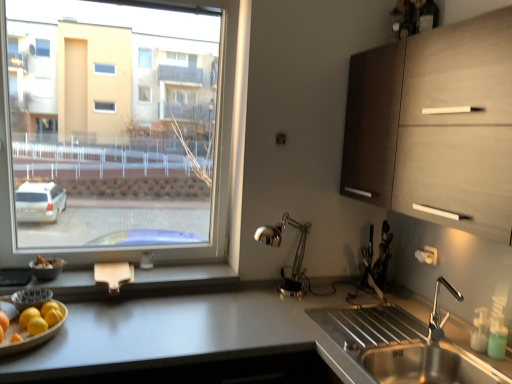
Question: Would you consider white glossy countertop at lower left to be distant from polished metal desk lamp at center?

Choices:
 (A) yes
 (B) no

Answer: (B)

Question: Can you confirm if white glossy countertop at lower left is wider than polished metal desk lamp at center?

Choices:
 (A) no
 (B) yes

Answer: (B)

Question: Are white glossy countertop at lower left and polished metal desk lamp at center making contact?

Choices:
 (A) no
 (B) yes

Answer: (A)

Question: Would you say white glossy countertop at lower left contains polished metal desk lamp at center?

Choices:
 (A) no
 (B) yes

Answer: (A)

Question: Is white glossy countertop at lower left facing away from polished metal desk lamp at center?

Choices:
 (A) yes
 (B) no

Answer: (B)

Question: From the image's perspective, is white glossy countertop at lower left under polished metal desk lamp at center?

Choices:
 (A) yes
 (B) no

Answer: (A)

Question: Considering the relative positions of polished metal desk lamp at center and wooden tray with fruits at lower left in the image provided, is polished metal desk lamp at center to the right of wooden tray with fruits at lower left from the viewer's perspective?

Choices:
 (A) no
 (B) yes

Answer: (B)

Question: Considering the relative sizes of polished metal desk lamp at center and wooden tray with fruits at lower left in the image provided, is polished metal desk lamp at center smaller than wooden tray with fruits at lower left?

Choices:
 (A) yes
 (B) no

Answer: (B)

Question: Is polished metal desk lamp at center touching wooden tray with fruits at lower left?

Choices:
 (A) yes
 (B) no

Answer: (B)

Question: Is polished metal desk lamp at center further to camera compared to wooden tray with fruits at lower left?

Choices:
 (A) no
 (B) yes

Answer: (B)

Question: Is polished metal desk lamp at center looking in the opposite direction of wooden tray with fruits at lower left?

Choices:
 (A) no
 (B) yes

Answer: (A)

Question: Is the depth of polished metal desk lamp at center less than that of wooden tray with fruits at lower left?

Choices:
 (A) no
 (B) yes

Answer: (A)

Question: From a real-world perspective, is polished metal desk lamp at center on wooden at lower left?

Choices:
 (A) no
 (B) yes

Answer: (B)